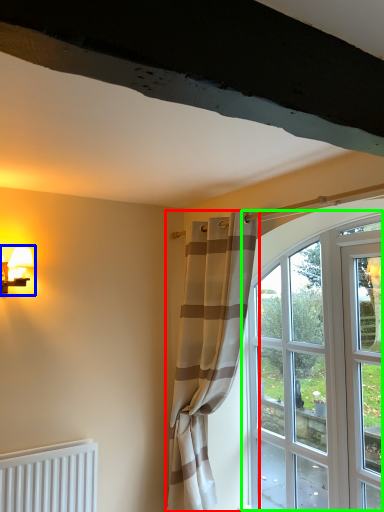
Question: Which object is the closest to the curtain (highlighted by a red box)? Choose among these: table lamp (highlighted by a blue box) or window (highlighted by a green box).

Choices:
 (A) table lamp
 (B) window

Answer: (B)